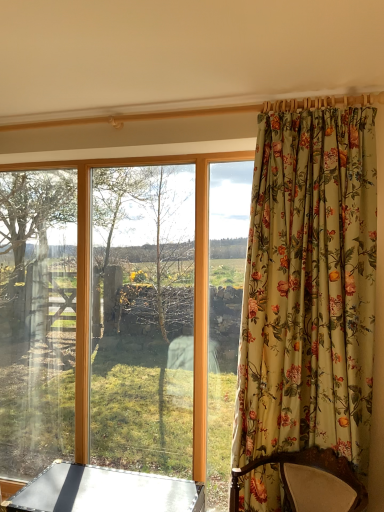
Question: In terms of size, does transparent glass window at center appear bigger or smaller than floral fabric curtain at right?

Choices:
 (A) big
 (B) small

Answer: (A)

Question: From the image's perspective, relative to floral fabric curtain at right, is transparent glass window at center above or below?

Choices:
 (A) below
 (B) above

Answer: (A)

Question: Considering the real-world distances, which object is farthest from the metallic silver table at lower left?

Choices:
 (A) velvet upholstered chair at right
 (B) floral fabric curtain at right
 (C) transparent glass window at center

Answer: (B)

Question: Which is nearer to the velvet upholstered chair at right?

Choices:
 (A) metallic silver table at lower left
 (B) floral fabric curtain at right
 (C) transparent glass window at center

Answer: (B)